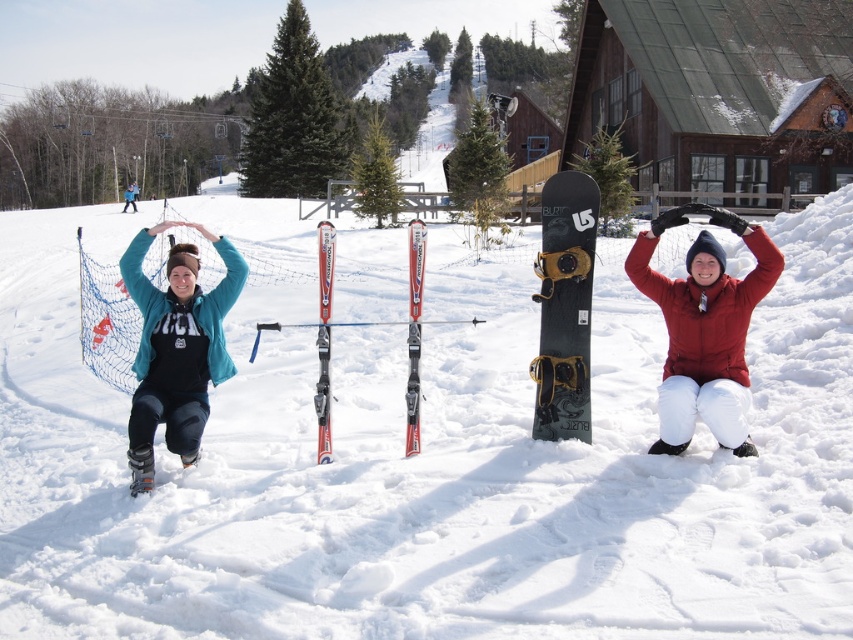
Is point (592, 243) positioned after point (322, 252)?

No, it is not.

Which is in front, point (552, 176) or point (326, 429)?

Point (326, 429) is in front.

Locate an element on the screen. The height and width of the screenshot is (640, 853). black matte snowboard at center is located at coordinates (564, 307).

Between matte red snowboard at right and shiny red skis at center, which one has more height?

With more height is matte red snowboard at right.

Can you confirm if matte red snowboard at right is positioned to the right of shiny red skis at center?

Correct, you'll find matte red snowboard at right to the right of shiny red skis at center.

Who is more forward, (724,289) or (413,256)?

Point (724,289) is more forward.

Where is `matte red snowboard at right`? The image size is (853, 640). matte red snowboard at right is located at coordinates (704, 328).

Between brushed metal ski boots at lower left and red metallic skis at center, which one appears on the left side from the viewer's perspective?

brushed metal ski boots at lower left is more to the left.

Is brushed metal ski boots at lower left shorter than red metallic skis at center?

Yes, brushed metal ski boots at lower left is shorter than red metallic skis at center.

Who is more forward, (171, 321) or (323, 260)?

Point (171, 321) is in front.

Locate an element on the screen. This screenshot has width=853, height=640. brushed metal ski boots at lower left is located at coordinates point(177,348).